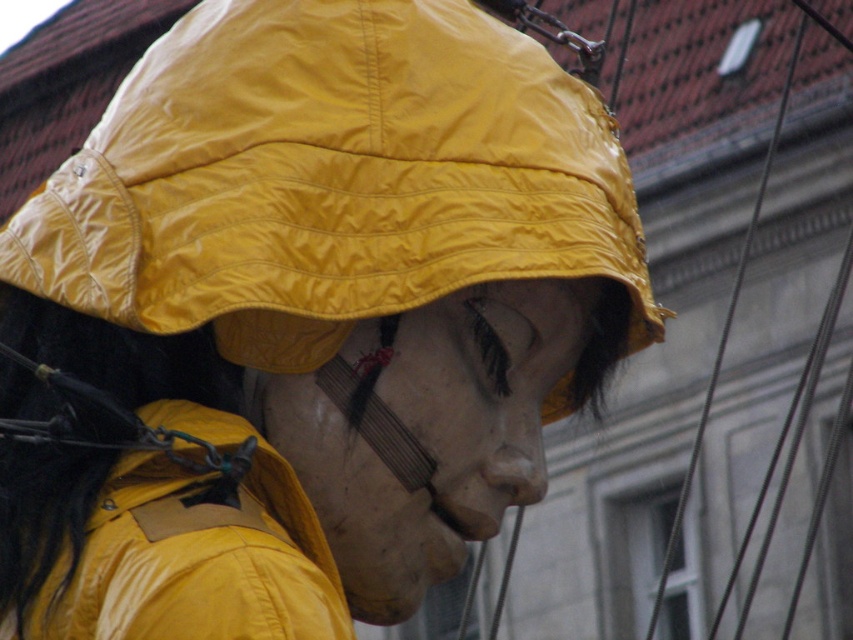
Question: Which point appears closest to the camera in this image?

Choices:
 (A) (459, 545)
 (B) (94, 531)
 (C) (12, 273)

Answer: (B)

Question: Does matte white mask at center have a lesser width compared to matte yellow jacket at lower left?

Choices:
 (A) yes
 (B) no

Answer: (B)

Question: Based on their relative distances, which object is farther from the yellow matte hat at center?

Choices:
 (A) matte yellow jacket at lower left
 (B) matte white mask at center

Answer: (A)

Question: Considering the real-world distances, which object is farthest from the matte yellow jacket at lower left?

Choices:
 (A) yellow matte hat at center
 (B) matte white mask at center

Answer: (A)

Question: Is matte white mask at center smaller than matte yellow jacket at lower left?

Choices:
 (A) no
 (B) yes

Answer: (A)

Question: Does yellow matte hat at center appear on the right side of matte white mask at center?

Choices:
 (A) yes
 (B) no

Answer: (A)